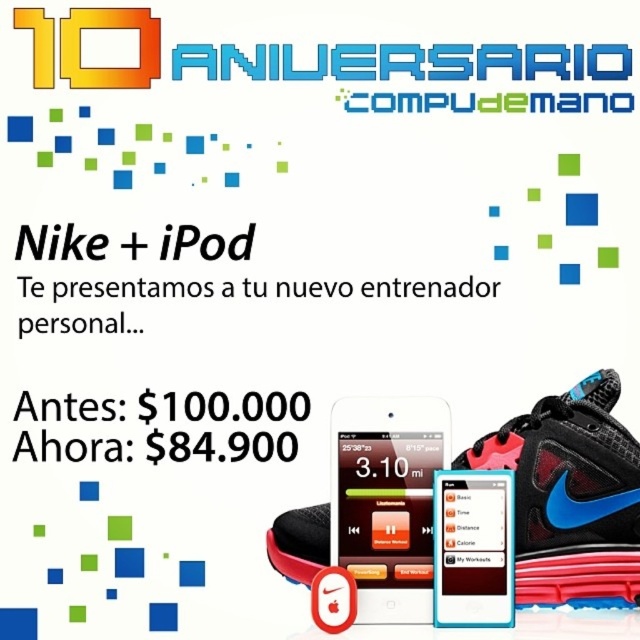
What are the coordinates of the satin black smartphone at center?

The coordinates of the satin black smartphone at center are at point (387, 500).

You are a customer looking at the advertisement for CompuDeMano. You see a black mesh shoe at lower right and a matte white smartphone at center. Which object is closer to you?

The black mesh shoe at lower right is closer to you than the matte white smartphone at center.